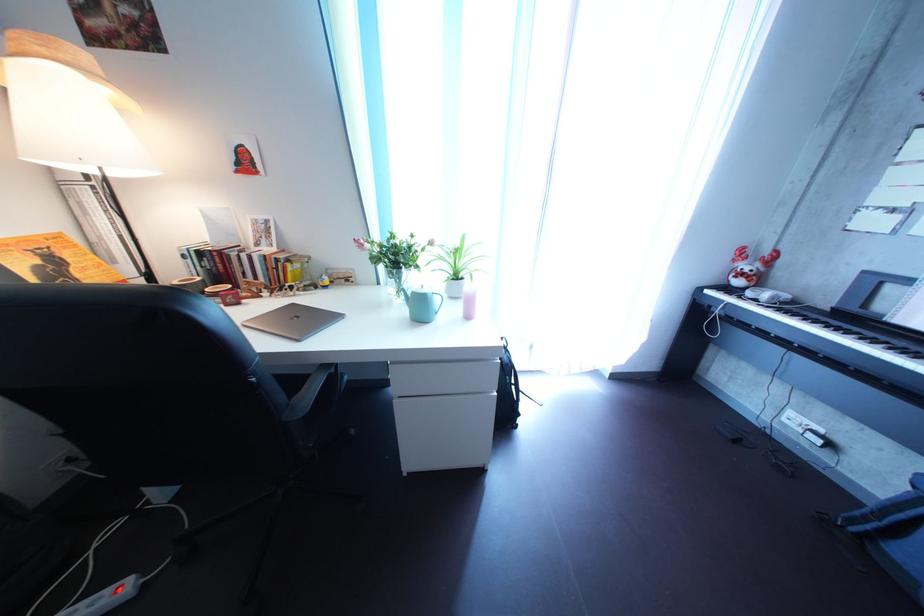
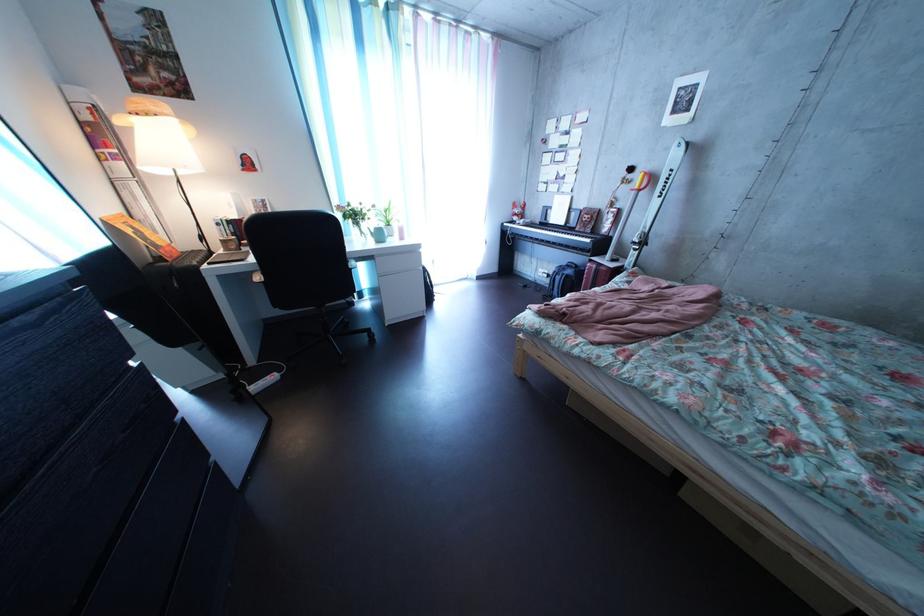
The point at (37,273) is marked in the first image. Where is the corresponding point in the second image?

(142, 238)